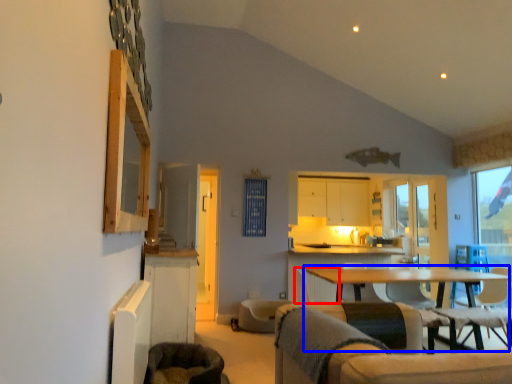
Question: Which object appears closest to the camera in this image, armchair (highlighted by a red box) or table (highlighted by a blue box)?

Choices:
 (A) armchair
 (B) table

Answer: (B)